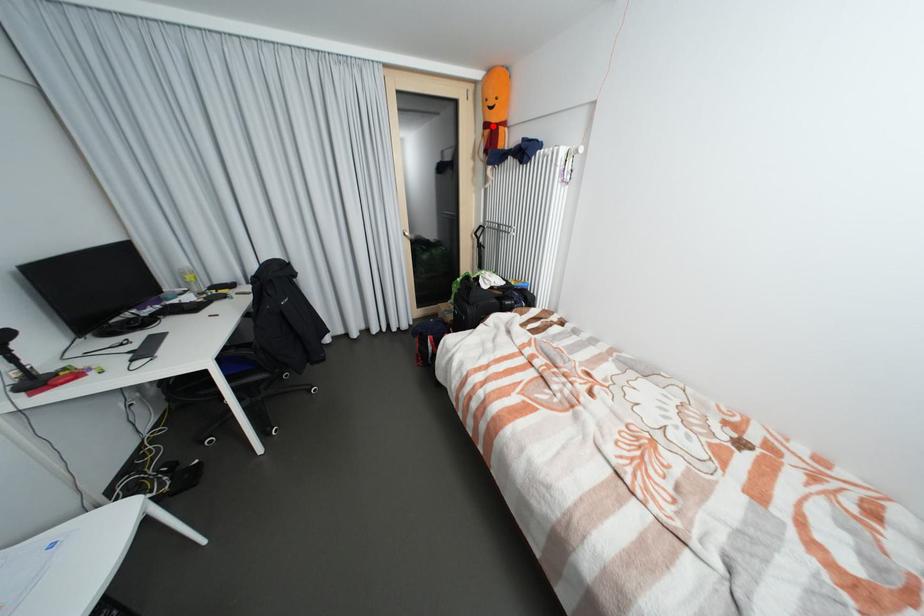
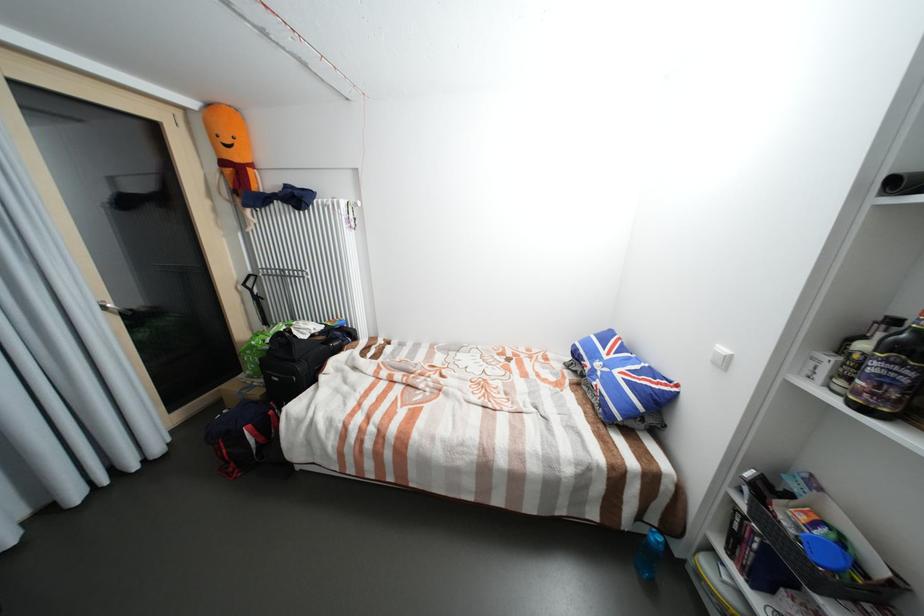
The point at the highlighted location is marked in the first image. Where is the corresponding point in the second image?

(229, 163)